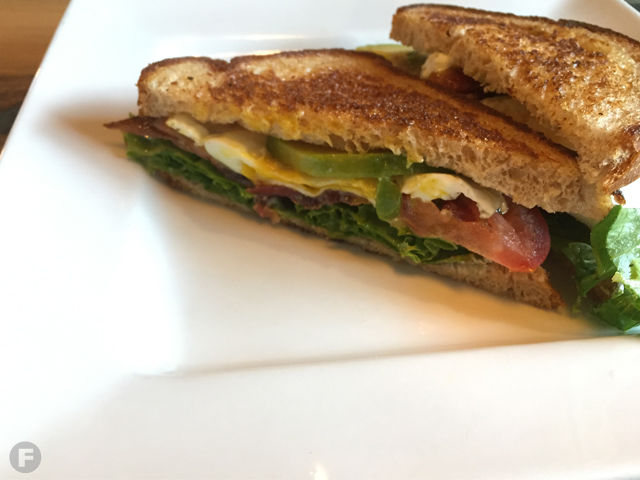
Find the location of a particular element. napkin is located at coordinates (470, 420).